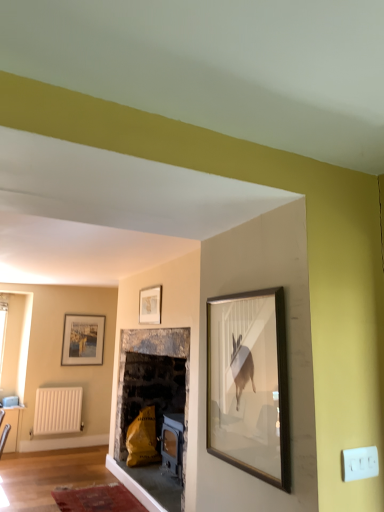
Measure the distance between point (147, 320) and camera.

Point (147, 320) and camera are 15.25 feet apart from each other.

I want to click on white matte radiator at lower left, so click(57, 410).

Is point (144, 289) positioned after point (42, 393)?

No, it is in front of (42, 393).

Considering the relative sizes of wooden picture frame at upper center, the first picture frame from the front, and white matte radiator at lower left in the image provided, is wooden picture frame at upper center, the first picture frame from the front, smaller than white matte radiator at lower left?

Yes, wooden picture frame at upper center, the first picture frame from the front, is smaller than white matte radiator at lower left.

Relative to white matte radiator at lower left, is wooden picture frame at upper center, the first picture frame from the front, in front or behind?

wooden picture frame at upper center, the first picture frame from the front, is in front of white matte radiator at lower left.

The image size is (384, 512). Identify the location of radiator below the wooden picture frame at upper center, the second picture frame in the back-to-front sequence (from a real-world perspective). (57, 410).

Is matte white picture frame at left, which is counted as the 1th picture frame, starting from the bottom, situated inside wooden picture frame at upper center, which is counted as the second picture frame, starting from the left, or outside?

matte white picture frame at left, which is counted as the 1th picture frame, starting from the bottom, is outside wooden picture frame at upper center, which is counted as the second picture frame, starting from the left.

From the image's perspective, is matte white picture frame at left, which is counted as the second picture frame, starting from the right, above or below wooden picture frame at upper center, arranged as the second picture frame when ordered from the bottom?

Based on their image positions, matte white picture frame at left, which is counted as the second picture frame, starting from the right, is located beneath wooden picture frame at upper center, arranged as the second picture frame when ordered from the bottom.

How different are the orientations of matte white picture frame at left, the second picture frame from the top, and wooden picture frame at upper center, the second picture frame in the back-to-front sequence, in degrees?

The angle between the facing direction of matte white picture frame at left, the second picture frame from the top, and the facing direction of wooden picture frame at upper center, the second picture frame in the back-to-front sequence, is 92.2 degrees.

Where is `picture frame behind the wooden picture frame at upper center, the second picture frame in the back-to-front sequence`? The width and height of the screenshot is (384, 512). picture frame behind the wooden picture frame at upper center, the second picture frame in the back-to-front sequence is located at coordinates (83, 340).

Is wooden picture frame at upper center, which is counted as the second picture frame, starting from the left, far from matte white picture frame at left, the second picture frame from the top?

Absolutely, wooden picture frame at upper center, which is counted as the second picture frame, starting from the left, is distant from matte white picture frame at left, the second picture frame from the top.

Can you confirm if wooden picture frame at upper center, which is the 1th picture frame from right to left, is bigger than matte white picture frame at left, the 2th picture frame positioned from the front?

No.

Which is farther, (87, 322) or (64, 407)?

The point (87, 322) is farther.

Is matte white picture frame at left, the 2th picture frame positioned from the front, beside white matte radiator at lower left?

No, matte white picture frame at left, the 2th picture frame positioned from the front, is not with white matte radiator at lower left.

Is matte white picture frame at left, which appears as the 1th picture frame when viewed from the back, thinner than white matte radiator at lower left?

Correct, the width of matte white picture frame at left, which appears as the 1th picture frame when viewed from the back, is less than that of white matte radiator at lower left.

From a real-world perspective, which object rests below the other?

white matte radiator at lower left.

Is white matte radiator at lower left far away from matte white picture frame at left, which is counted as the 1th picture frame, starting from the bottom?

No, white matte radiator at lower left is not far from matte white picture frame at left, which is counted as the 1th picture frame, starting from the bottom.

Which is behind, point (47, 417) or point (83, 329)?

The point (83, 329) is farther.

From the image's perspective, which object appears higher, white matte radiator at lower left or matte white picture frame at left, which is counted as the second picture frame, starting from the right?

matte white picture frame at left, which is counted as the second picture frame, starting from the right, from the image's perspective.

Which of these two, white matte radiator at lower left or wooden picture frame at upper center, the second picture frame in the back-to-front sequence, stands taller?

white matte radiator at lower left is taller.

Can we say white matte radiator at lower left lies outside wooden picture frame at upper center, the first picture frame from the front?

Yes, white matte radiator at lower left is not within wooden picture frame at upper center, the first picture frame from the front.

Is white matte radiator at lower left bigger or smaller than wooden picture frame at upper center, arranged as the second picture frame when ordered from the bottom?

Answer: white matte radiator at lower left is bigger than wooden picture frame at upper center, arranged as the second picture frame when ordered from the bottom.

Which is in front, point (35, 412) or point (155, 304)?

Positioned in front is point (155, 304).

The image size is (384, 512). Identify the location of radiator that appears below the wooden picture frame at upper center, the second picture frame in the back-to-front sequence (from the image's perspective). [x=57, y=410].

I want to click on picture frame in front of the matte white picture frame at left, the 2th picture frame positioned from the front, so click(x=150, y=305).

Based on their spatial positions, is white matte radiator at lower left or wooden picture frame at upper center, the first picture frame from the front, further from matte white picture frame at left, which appears as the 1th picture frame when viewed from the back?

wooden picture frame at upper center, the first picture frame from the front, is positioned further to the anchor matte white picture frame at left, which appears as the 1th picture frame when viewed from the back.

Looking at this image, looking at the image, which one is located further to wooden picture frame at upper center, which is the 1th picture frame from right to left, matte white picture frame at left, which appears as the 1th picture frame when viewed from the back, or white matte radiator at lower left?

The object further to wooden picture frame at upper center, which is the 1th picture frame from right to left, is white matte radiator at lower left.

In the scene shown: When comparing their distances from white matte radiator at lower left, does matte white picture frame at left, the second picture frame from the top, or wooden picture frame at upper center, which is the 1th picture frame from right to left, seem closer?

matte white picture frame at left, the second picture frame from the top, lies closer to white matte radiator at lower left than the other object.

Considering their positions, is wooden picture frame at upper center, arranged as the second picture frame when ordered from the bottom, positioned further to matte white picture frame at left, which is counted as the 1th picture frame, starting from the bottom, than white matte radiator at lower left?

Based on the image, wooden picture frame at upper center, arranged as the second picture frame when ordered from the bottom, appears to be further to matte white picture frame at left, which is counted as the 1th picture frame, starting from the bottom.

When comparing their distances from wooden picture frame at upper center, which is counted as the second picture frame, starting from the left, does white matte radiator at lower left or matte white picture frame at left, acting as the 1th picture frame starting from the left, seem closer?

Among the two, matte white picture frame at left, acting as the 1th picture frame starting from the left, is located nearer to wooden picture frame at upper center, which is counted as the second picture frame, starting from the left.

Estimate the real-world distances between objects in this image. Which object is further from white matte radiator at lower left, wooden picture frame at upper center, the second picture frame in the back-to-front sequence, or matte white picture frame at left, the second picture frame from the top?

wooden picture frame at upper center, the second picture frame in the back-to-front sequence, is positioned further to the anchor white matte radiator at lower left.

At what (x,y) coordinates should I click in order to perform the action: click on radiator between wooden picture frame at upper center, the first picture frame from the front, and matte white picture frame at left, acting as the 1th picture frame starting from the left, in the front-back direction. Please return your answer as a coordinate pair (x, y). Image resolution: width=384 pixels, height=512 pixels. Looking at the image, I should click on (57, 410).